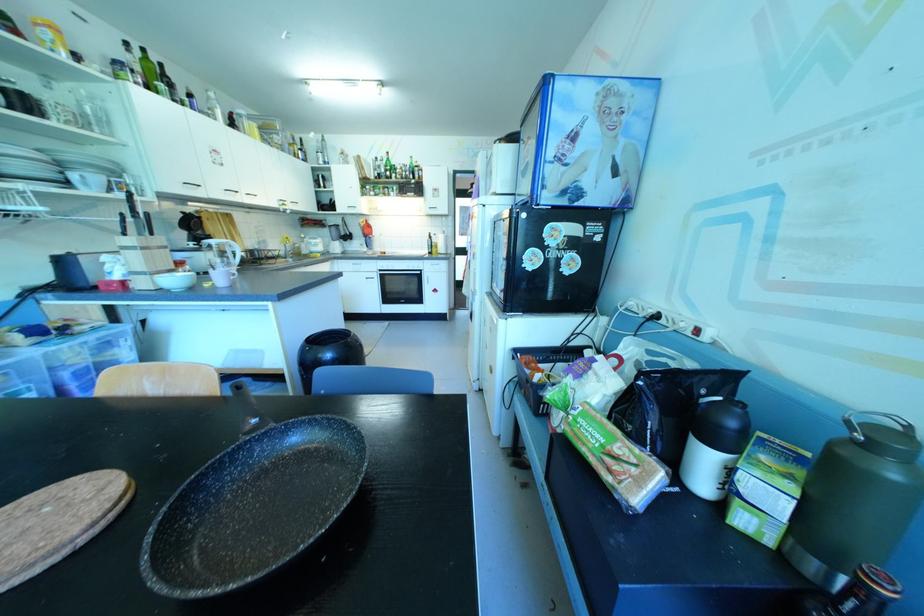
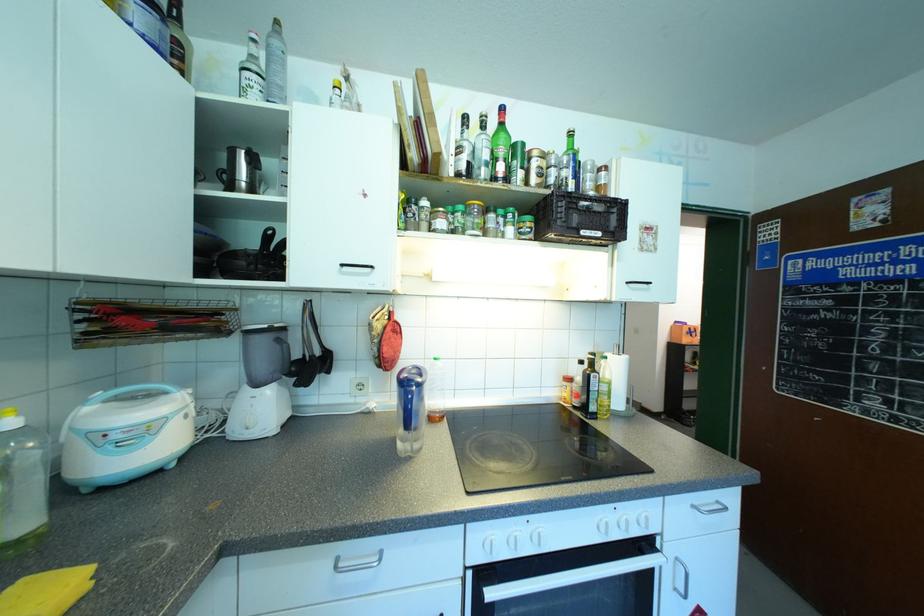
In the second image, find the point that corresponds to (319,240) in the first image.

(172, 403)